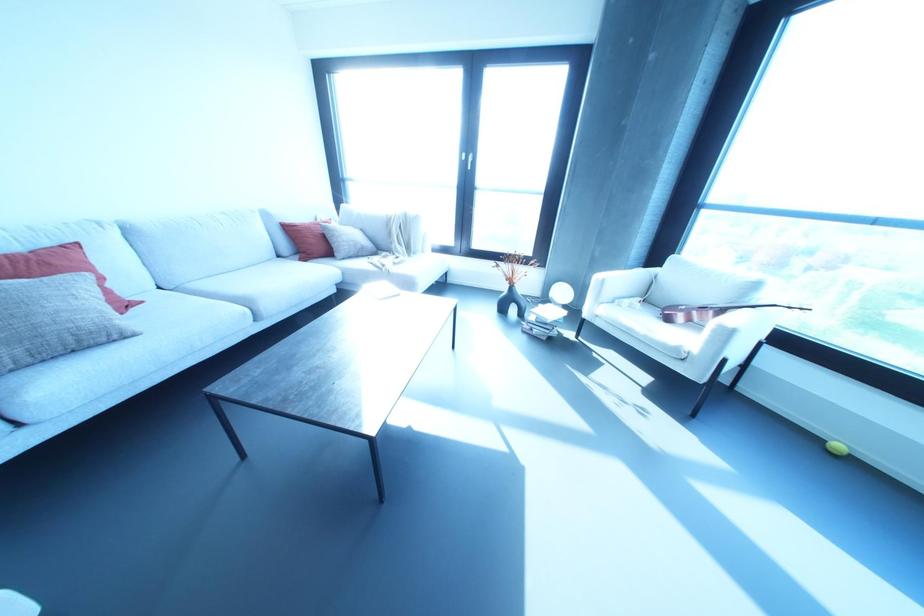
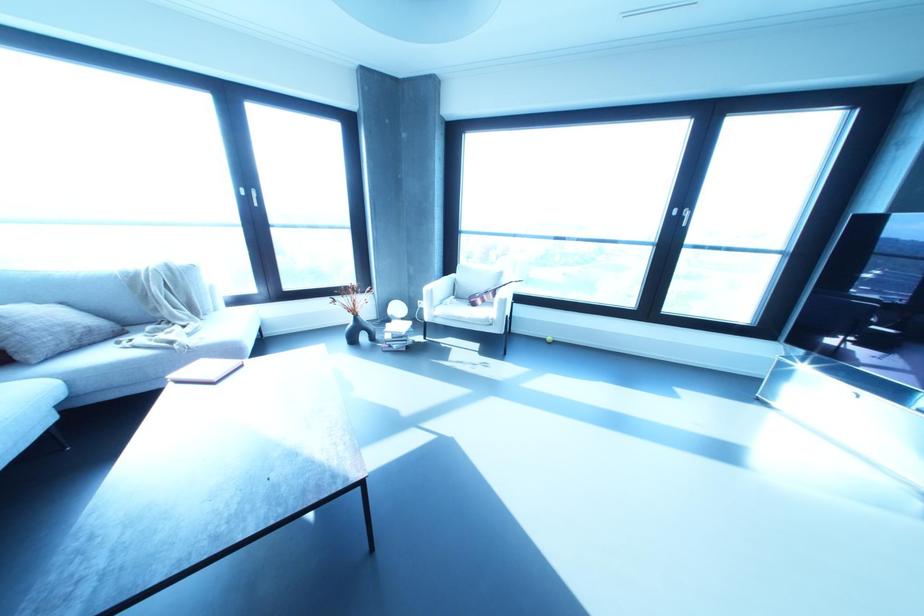
Where in the second image is the point corresponding to (x=361, y=246) from the first image?

(90, 330)